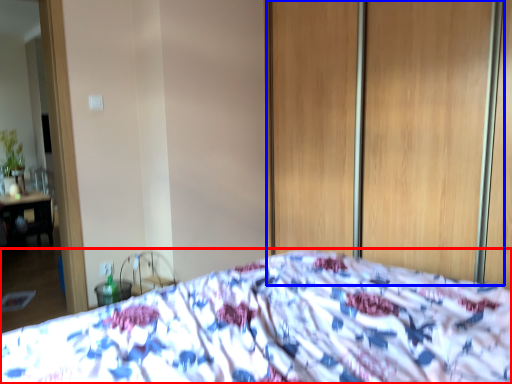
Question: Which of the following is the closest to the observer, bed (highlighted by a red box) or screen door (highlighted by a blue box)?

Choices:
 (A) bed
 (B) screen door

Answer: (A)